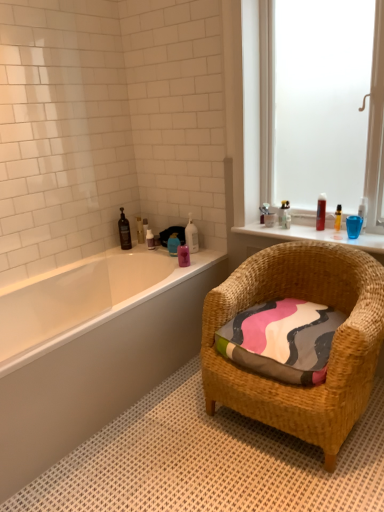
Where is `blank space situated above textured beige bath mat at lower center (from a real-world perspective)`? blank space situated above textured beige bath mat at lower center (from a real-world perspective) is located at coordinates (218, 456).